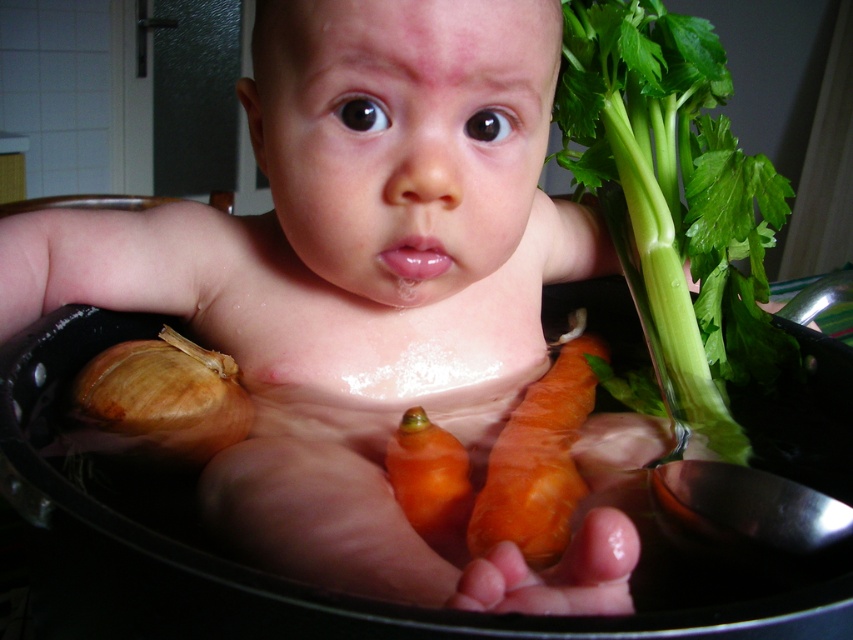
Question: Estimate the real-world distances between objects in this image. Which object is farther from the orange matte carrot at center?

Choices:
 (A) green leafy material at upper right
 (B) brown matte onion at lower left

Answer: (A)

Question: Is brown matte onion at lower left to the right of orange smooth carrot at center from the viewer's perspective?

Choices:
 (A) no
 (B) yes

Answer: (A)

Question: Where is green leafy material at upper right located in relation to orange matte carrot at center in the image?

Choices:
 (A) left
 (B) right

Answer: (B)

Question: Which object is farther from the camera taking this photo?

Choices:
 (A) green leafy material at upper right
 (B) orange smooth carrot at center

Answer: (A)

Question: Does green leafy material at upper right appear under orange matte carrot at center?

Choices:
 (A) yes
 (B) no

Answer: (B)

Question: Which object is closer to the camera taking this photo?

Choices:
 (A) brown matte onion at lower left
 (B) orange smooth carrot at center
 (C) orange matte carrot at center
 (D) green leafy material at upper right

Answer: (B)